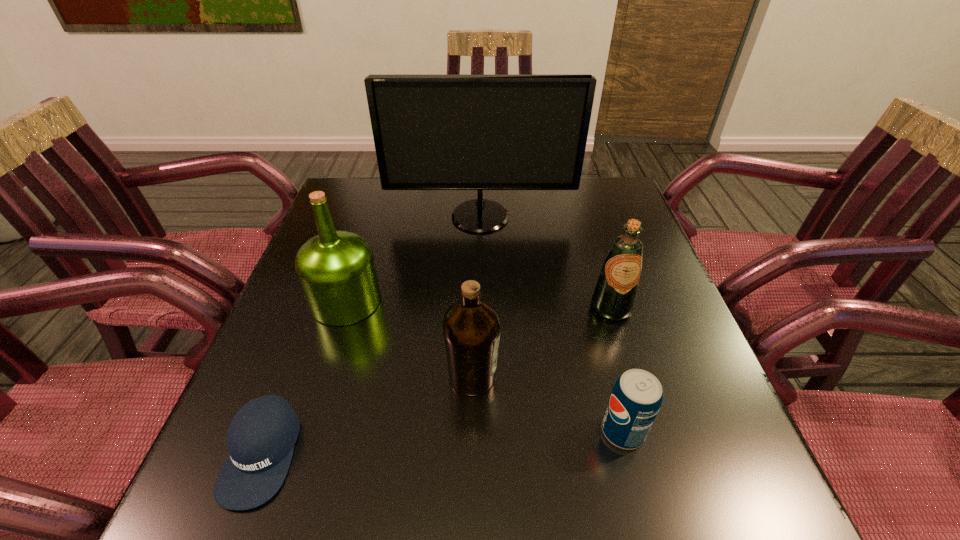
Where is `vacant area at the far edge`? This screenshot has width=960, height=540. vacant area at the far edge is located at coordinates (399, 217).

Find the location of a particular element. vacant area at the near edge of the desktop is located at coordinates coord(480,498).

You are a GUI agent. You are given a task and a screenshot of the screen. Output one action in this format:
    pyautogui.click(x=<x>, y=<y>)
    Task: Click on the free space at the left edge of the desktop
    The height and width of the screenshot is (540, 960).
    Given the screenshot: What is the action you would take?
    pyautogui.click(x=269, y=393)

What are the coordinates of `vacant space at the right edge` in the screenshot? It's located at (685, 372).

Locate an element on the screen. vacant region at the far left corner of the desktop is located at coordinates (348, 217).

Find the location of a particular element. Image resolution: width=960 pixels, height=540 pixels. free spot between the pop and the rightmost olive oil is located at coordinates (617, 369).

The height and width of the screenshot is (540, 960). Find the location of `vacant region between the leftmost olive oil and the baseball cap`. vacant region between the leftmost olive oil and the baseball cap is located at coordinates (304, 377).

Locate an element on the screen. unoccupied position between the pop and the tallest object is located at coordinates (552, 324).

I want to click on blank region between the baseball cap and the farthest object, so click(372, 335).

The height and width of the screenshot is (540, 960). Identify the location of vacant space that's between the pop and the rightmost olive oil. (617, 369).